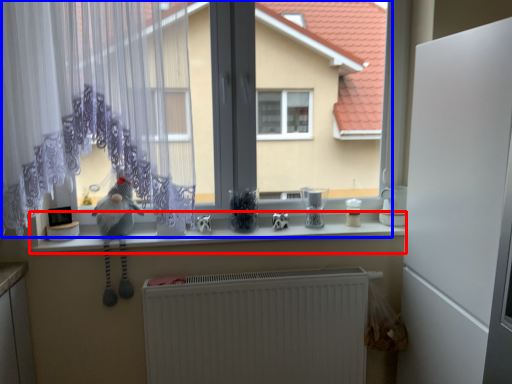
Question: Which of the following is the farthest to the observer, counter top (highlighted by a red box) or bay window (highlighted by a blue box)?

Choices:
 (A) counter top
 (B) bay window

Answer: (A)